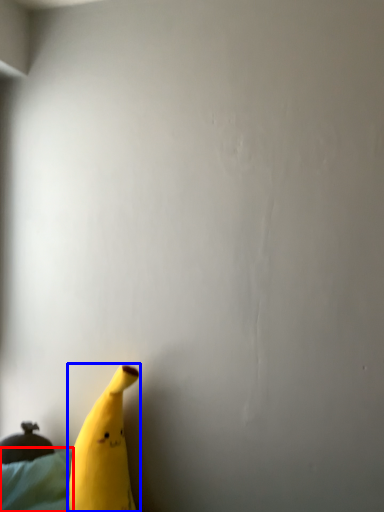
Question: Which object is closer to the camera taking this photo, sheet (highlighted by a red box) or banana (highlighted by a blue box)?

Choices:
 (A) sheet
 (B) banana

Answer: (B)